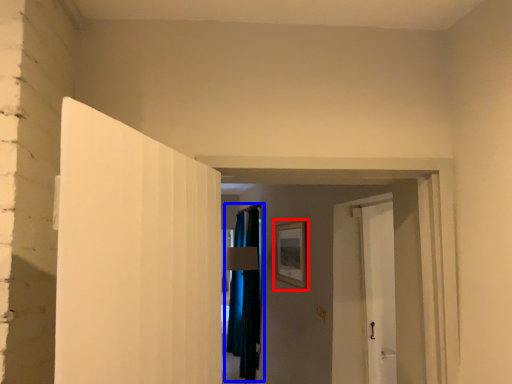
Question: Among these objects, which one is farthest to the camera, picture frame (highlighted by a red box) or curtain (highlighted by a blue box)?

Choices:
 (A) picture frame
 (B) curtain

Answer: (B)